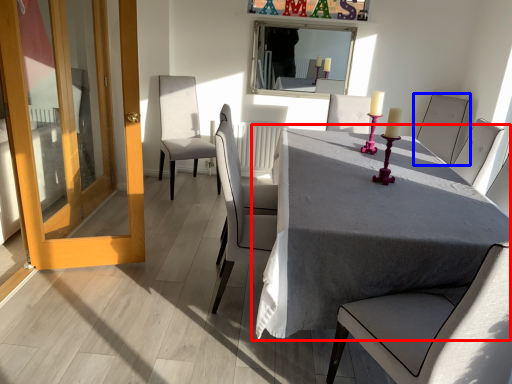
Question: Which object appears farthest to the camera in this image, table (highlighted by a red box) or chair (highlighted by a blue box)?

Choices:
 (A) table
 (B) chair

Answer: (B)